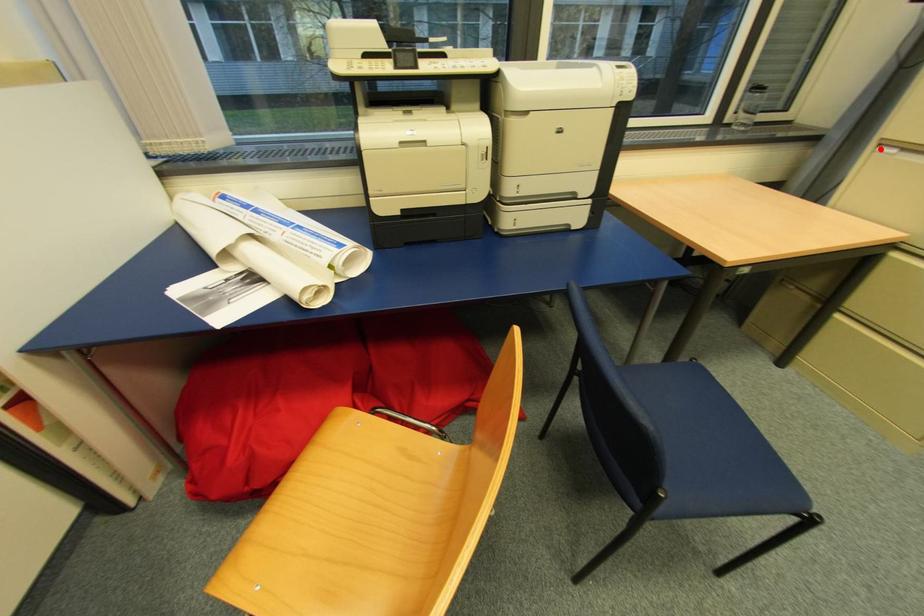
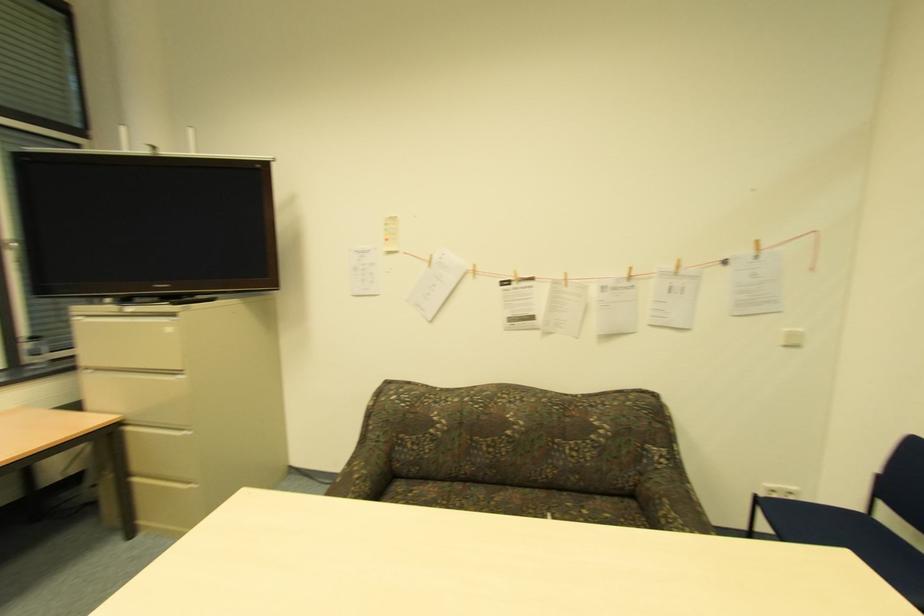
Locate, in the second image, the point that corresponds to the highlighted location in the first image.

(91, 370)